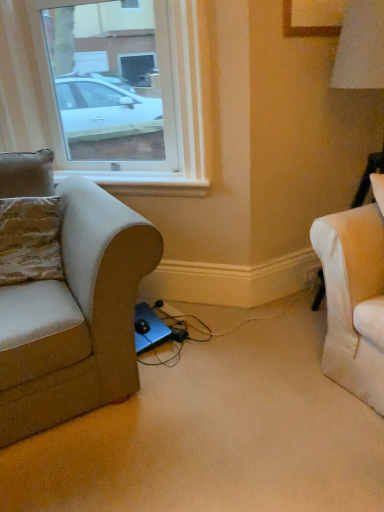
Question: Is textured beige pillow at left facing away from matte beige couch at left?

Choices:
 (A) yes
 (B) no

Answer: (A)

Question: Could you tell me if textured beige pillow at left is facing matte beige couch at left?

Choices:
 (A) no
 (B) yes

Answer: (B)

Question: Does textured beige pillow at left come in front of matte beige couch at left?

Choices:
 (A) no
 (B) yes

Answer: (A)

Question: Would you say textured beige pillow at left contains matte beige couch at left?

Choices:
 (A) no
 (B) yes

Answer: (A)

Question: From a real-world perspective, is textured beige pillow at left positioned under matte beige couch at left based on gravity?

Choices:
 (A) yes
 (B) no

Answer: (B)

Question: From a real-world perspective, is black plastic electric outlet at lower right above or below transparent glass window at upper left?

Choices:
 (A) above
 (B) below

Answer: (B)

Question: Is black plastic electric outlet at lower right in front of or behind transparent glass window at upper left in the image?

Choices:
 (A) behind
 (B) front

Answer: (A)

Question: In terms of height, does black plastic electric outlet at lower right look taller or shorter compared to transparent glass window at upper left?

Choices:
 (A) tall
 (B) short

Answer: (B)

Question: Is black plastic electric outlet at lower right wider or thinner than transparent glass window at upper left?

Choices:
 (A) wide
 (B) thin

Answer: (B)

Question: Is transparent glass window at upper left taller or shorter than textured beige pillow at left?

Choices:
 (A) short
 (B) tall

Answer: (B)

Question: From the image's perspective, is transparent glass window at upper left positioned above or below textured beige pillow at left?

Choices:
 (A) above
 (B) below

Answer: (A)

Question: Considering the positions of transparent glass window at upper left and textured beige pillow at left in the image, is transparent glass window at upper left wider or thinner than textured beige pillow at left?

Choices:
 (A) thin
 (B) wide

Answer: (B)

Question: Is transparent glass window at upper left bigger or smaller than textured beige pillow at left?

Choices:
 (A) big
 (B) small

Answer: (A)

Question: Looking at the image, does textured beige pillow at left seem bigger or smaller compared to transparent glass window at upper left?

Choices:
 (A) big
 (B) small

Answer: (B)

Question: Considering their positions, is textured beige pillow at left located in front of or behind transparent glass window at upper left?

Choices:
 (A) behind
 (B) front

Answer: (B)